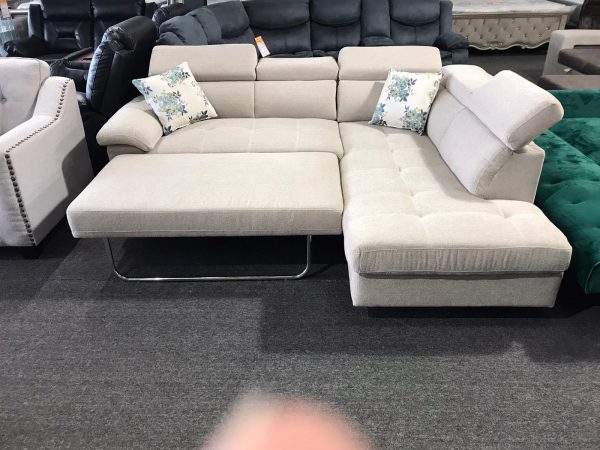
This screenshot has height=450, width=600. I want to click on metal leg on sectional, so click(x=305, y=269), click(x=209, y=279), click(x=130, y=280).